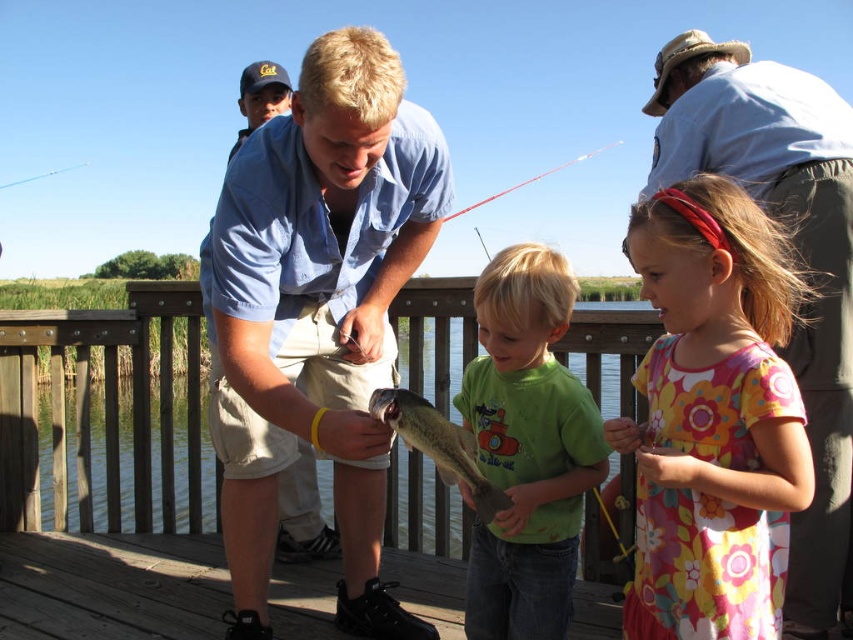
Between green matte shirt at center and clear plastic rod at upper left, which one is positioned lower?

Positioned lower is green matte shirt at center.

Does green matte shirt at center appear under clear plastic rod at upper left?

Correct, green matte shirt at center is located below clear plastic rod at upper left.

Measure the distance between point (585, 433) and camera.

Point (585, 433) and camera are 6.29 feet apart from each other.

Locate an element on the screen. The image size is (853, 640). green matte shirt at center is located at coordinates (527, 448).

Is the position of floral cotton dress at center more distant than that of red fiberglass rod at upper center?

No, it is not.

Between point (766, 525) and point (506, 193), which one is positioned behind?

The point (506, 193) is more distant.

Locate an element on the screen. floral cotton dress at center is located at coordinates (712, 417).

Is floral cotton dress at center positioned before clear plastic rod at upper left?

Yes, it is in front of clear plastic rod at upper left.

Which is behind, point (675, 257) or point (28, 177)?

The point (28, 177) is behind.

Where is `floral cotton dress at center`? This screenshot has height=640, width=853. floral cotton dress at center is located at coordinates (712, 417).